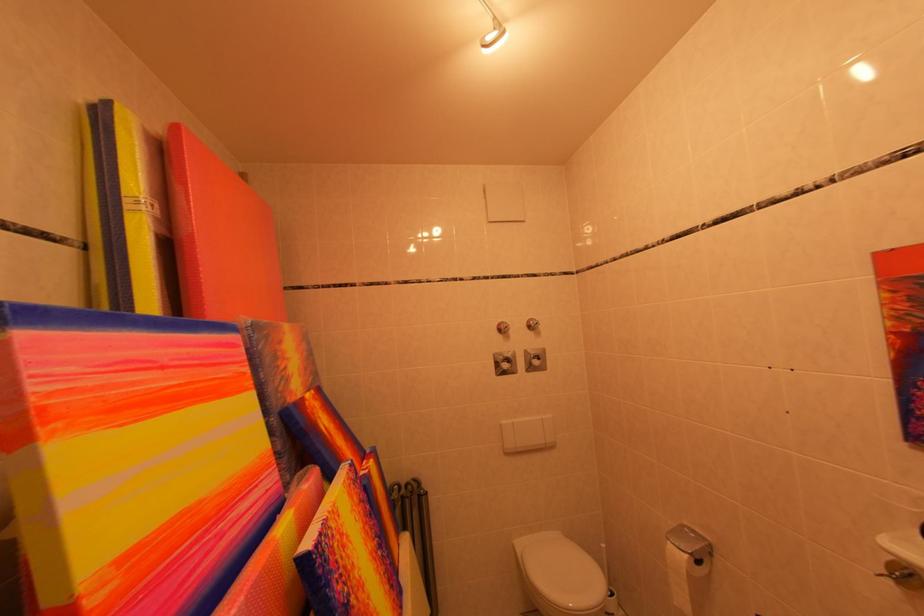
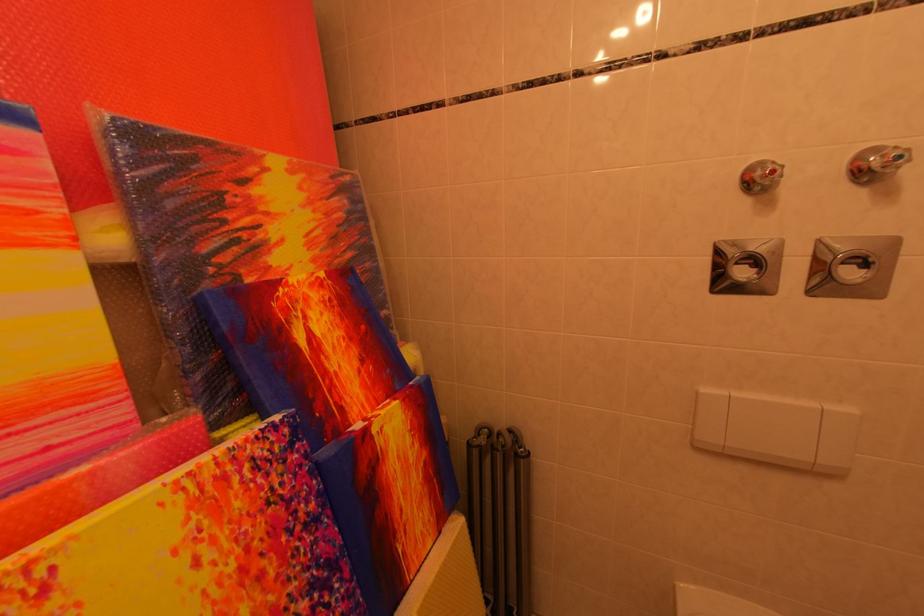
Where in the second image is the point corresponding to (x=369, y=485) from the first image?

(313, 460)